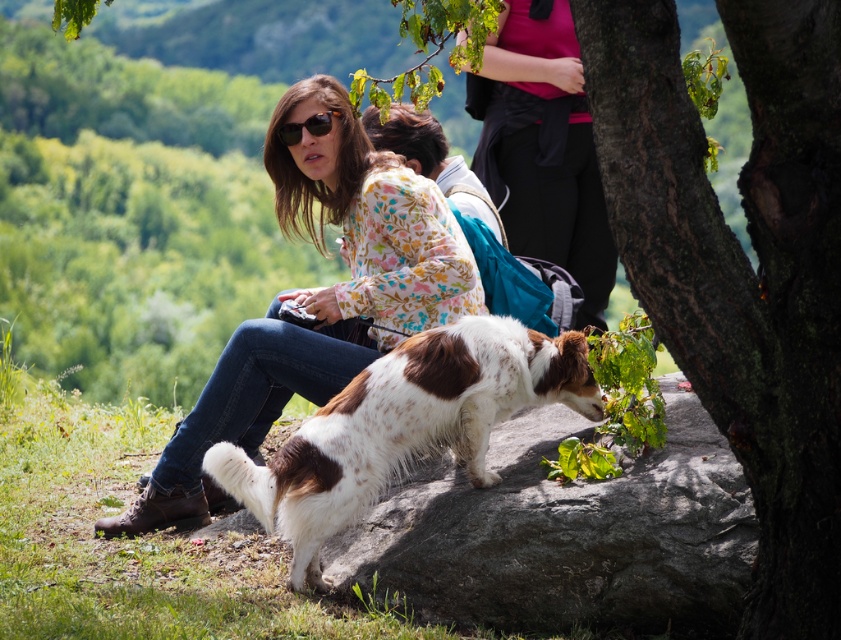
Question: Considering the real-world distances, which object is farthest from the floral-patterned blouse at center?

Choices:
 (A) brown textured bark at center right
 (B) matte black sunglasses at upper center
 (C) smooth gray rock at center

Answer: (A)

Question: Can you confirm if floral-patterned blouse at center is positioned above matte pink shirt at upper center?

Choices:
 (A) yes
 (B) no

Answer: (B)

Question: Is brown textured bark at center right to the left of matte pink shirt at upper center from the viewer's perspective?

Choices:
 (A) no
 (B) yes

Answer: (A)

Question: Does floral-patterned blouse at center appear over matte pink shirt at upper center?

Choices:
 (A) no
 (B) yes

Answer: (A)

Question: Considering the real-world distances, which object is farthest from the matte black sunglasses at upper center?

Choices:
 (A) floral-patterned blouse at center
 (B) brown textured bark at center right
 (C) matte pink shirt at upper center
 (D) smooth gray rock at center

Answer: (B)

Question: Which point appears farthest from the camera in this image?

Choices:
 (A) (297, 145)
 (B) (286, 385)

Answer: (A)